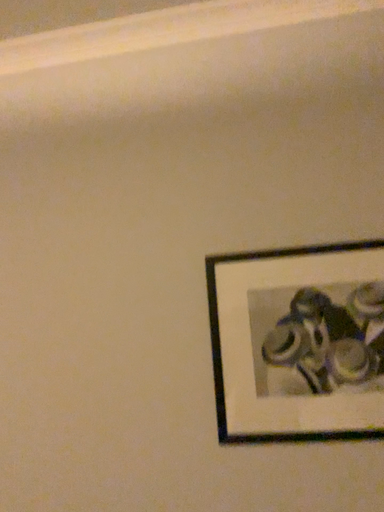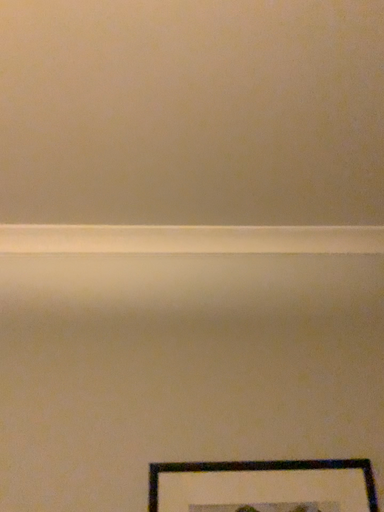
Question: How did the camera likely rotate when shooting the video?

Choices:
 (A) rotated downward
 (B) rotated upward

Answer: (B)